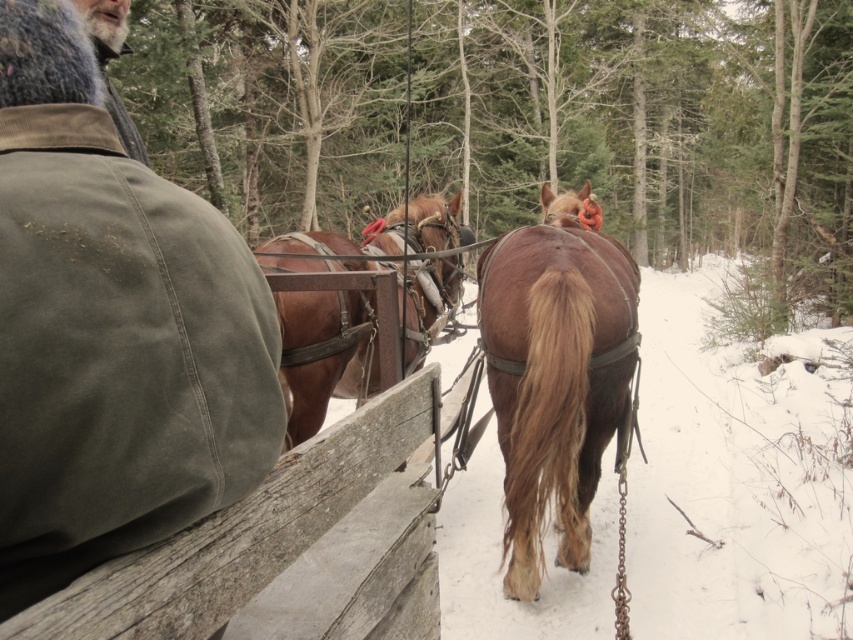
Question: Does brown leather horse at center appear over brown leather harness at center?

Choices:
 (A) no
 (B) yes

Answer: (A)

Question: Which point is farther from the camera taking this photo?

Choices:
 (A) (548, 248)
 (B) (100, 275)

Answer: (A)

Question: Estimate the real-world distances between objects in this image. Which object is closer to the brown leather horse at center?

Choices:
 (A) brown leather harness at center
 (B) green canvas coach at upper left

Answer: (A)

Question: Does green canvas coach at upper left appear under brown leather horse at center?

Choices:
 (A) no
 (B) yes

Answer: (B)

Question: Does brown leather horse at center appear on the right side of brown leather harness at center?

Choices:
 (A) yes
 (B) no

Answer: (A)

Question: Which point is farther to the camera?

Choices:
 (A) (50, 218)
 (B) (512, 541)

Answer: (B)